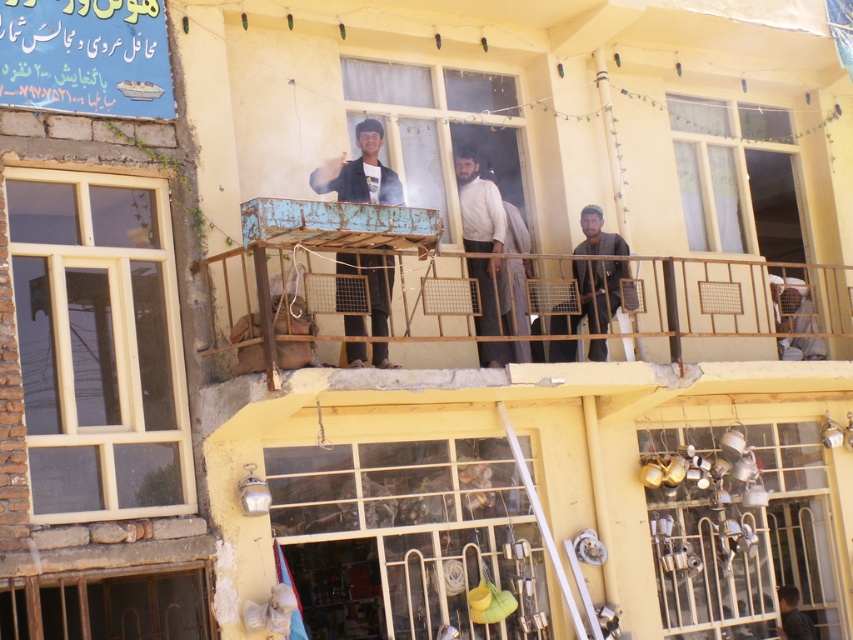
You are a photographer trying to capture a clear shot of the light brown fabric shirt at center. However, the transparent glass window at center is in the way. Can you adjust your position to take the photo without the window obstructing the view?

The transparent glass window at center is taller than the light brown fabric shirt at center, so you can lower your camera angle to avoid the window and capture the shirt without obstruction.